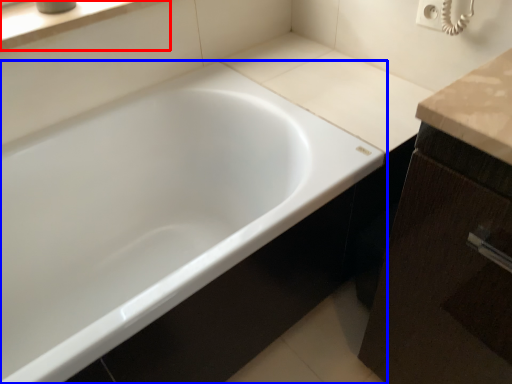
Question: Which of the following is the farthest to the observer, window sill (highlighted by a red box) or bathtub (highlighted by a blue box)?

Choices:
 (A) window sill
 (B) bathtub

Answer: (A)